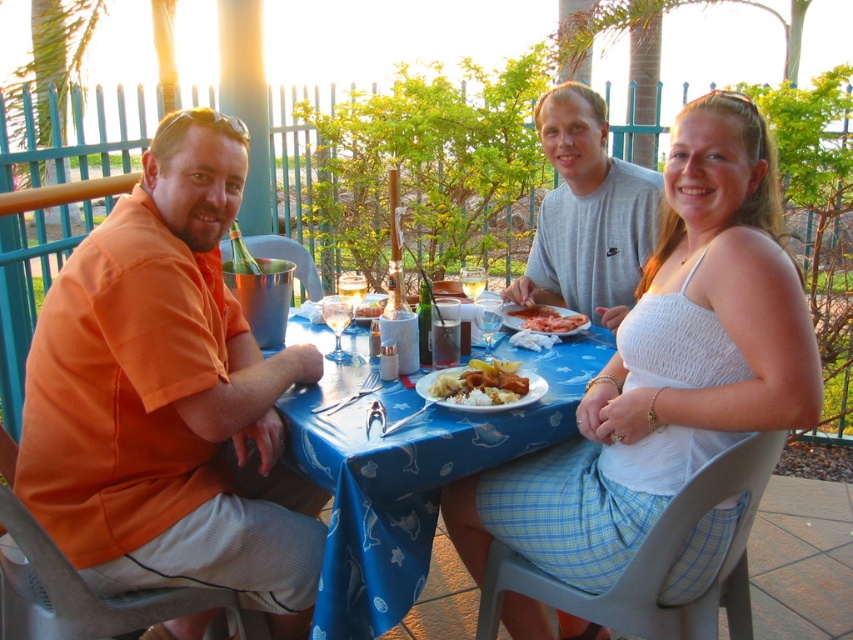
You are a photographer setting up a shot of the orange cotton shirt at left and the gray cotton shirt at center. You want to ensure both shirts are fully visible in the frame. Which shirt should you position closer to the center of the image to avoid cropping?

The orange cotton shirt at left should be positioned closer to the center of the image because it might be wider than the gray cotton shirt at center, reducing the risk of cropping.

You are a photographer setting up a shoot at this outdoor table. You want to ensure both the orange cotton shirt at left and the gray cotton shirt at center are visible in the frame. Based on their heights, which shirt should you position closer to the camera to avoid one blocking the other?

The orange cotton shirt at left is taller than the gray cotton shirt at center, so positioning the orange cotton shirt at left closer to the camera would prevent it from blocking the shorter gray cotton shirt at center.